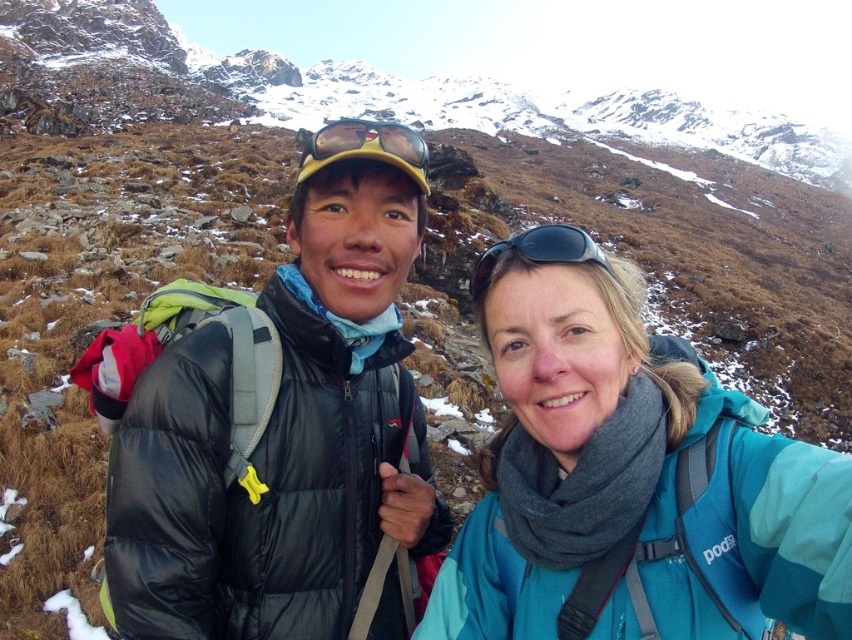
Is black puffer jacket at left positioned in front of teal fleece jacket at center?

That is False.

Can you confirm if black puffer jacket at left is positioned below teal fleece jacket at center?

Incorrect, black puffer jacket at left is not positioned below teal fleece jacket at center.

Is point (688, 541) positioned after point (809, 524)?

That is True.

Identify the location of black puffer jacket at left. The width and height of the screenshot is (852, 640). (300, 454).

Can you confirm if black puffer jacket at left is taller than yellow matte goggles at center?

In fact, black puffer jacket at left may be shorter than yellow matte goggles at center.

Does black puffer jacket at left come in front of yellow matte goggles at center?

Yes, black puffer jacket at left is closer to the viewer.

Does point (370, 285) lie in front of point (338, 125)?

No.

You are a GUI agent. You are given a task and a screenshot of the screen. Output one action in this format:
    pyautogui.click(x=<x>, y=<y>)
    Task: Click on the black puffer jacket at left
    This screenshot has width=852, height=640.
    Given the screenshot: What is the action you would take?
    pyautogui.click(x=300, y=454)

Can you confirm if black puffer jacket at center is bigger than black plastic sunglasses at center?

No.

Is black puffer jacket at center shorter than black plastic sunglasses at center?

No.

I want to click on black puffer jacket at center, so click(x=288, y=429).